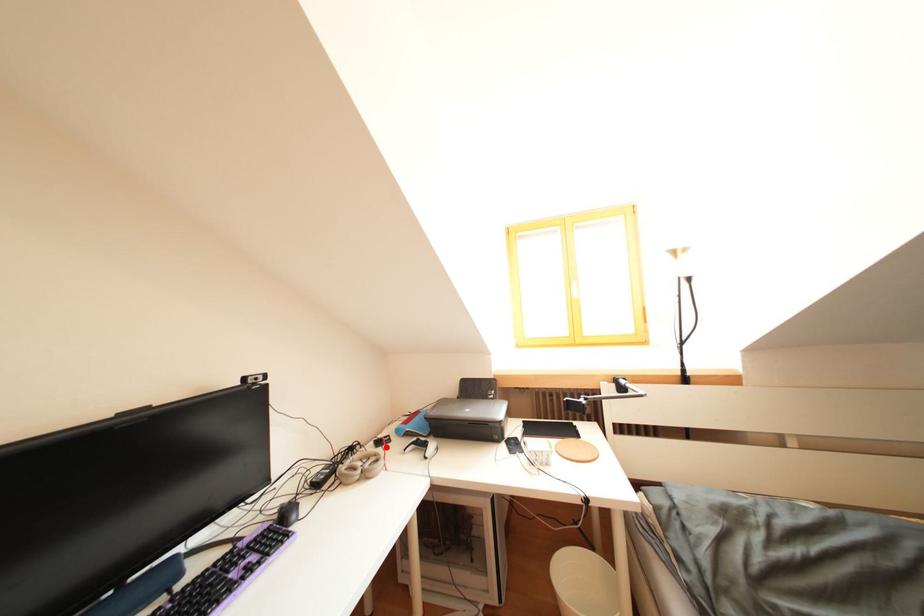
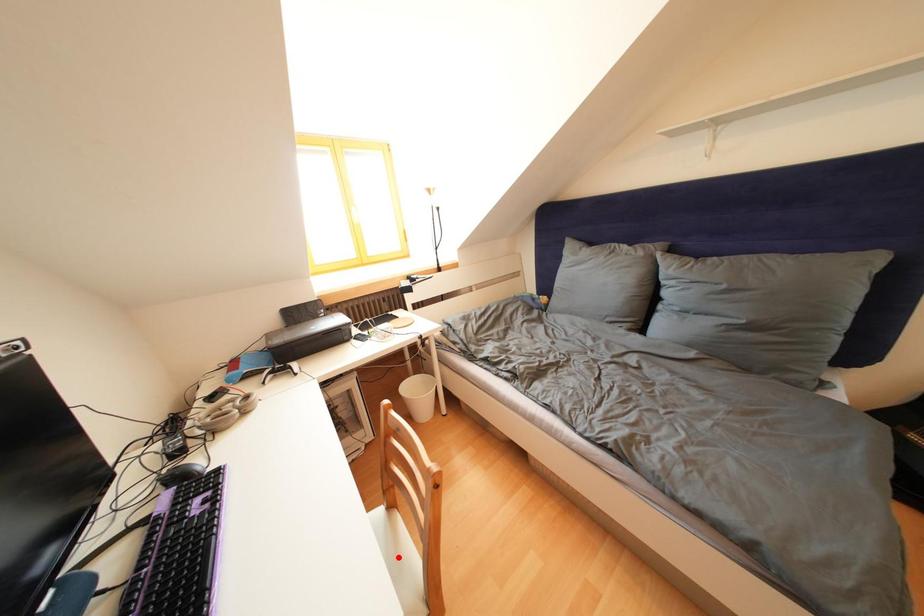
In the scene shown: I am providing you with two images of the same scene from different viewpoints. A red point is marked on the first image and another point is marked on the second image. Is the marked point in image1 the same physical position as the marked point in image2?

No